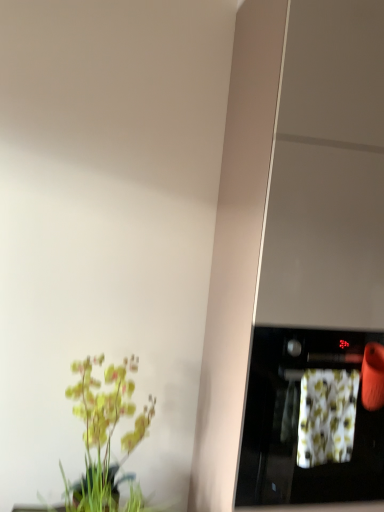
Question: From the image's perspective, relative to black glossy oven at right, is floral fabric at right above or below?

Choices:
 (A) above
 (B) below

Answer: (A)

Question: Relative to black glossy oven at right, is floral fabric at right in front or behind?

Choices:
 (A) behind
 (B) front

Answer: (A)

Question: Which of these objects is positioned farthest from the black glossy oven at right?

Choices:
 (A) green matte plant at lower left
 (B) floral fabric at right

Answer: (A)

Question: Which object is the closest to the floral fabric at right?

Choices:
 (A) black glossy oven at right
 (B) green matte plant at lower left

Answer: (A)